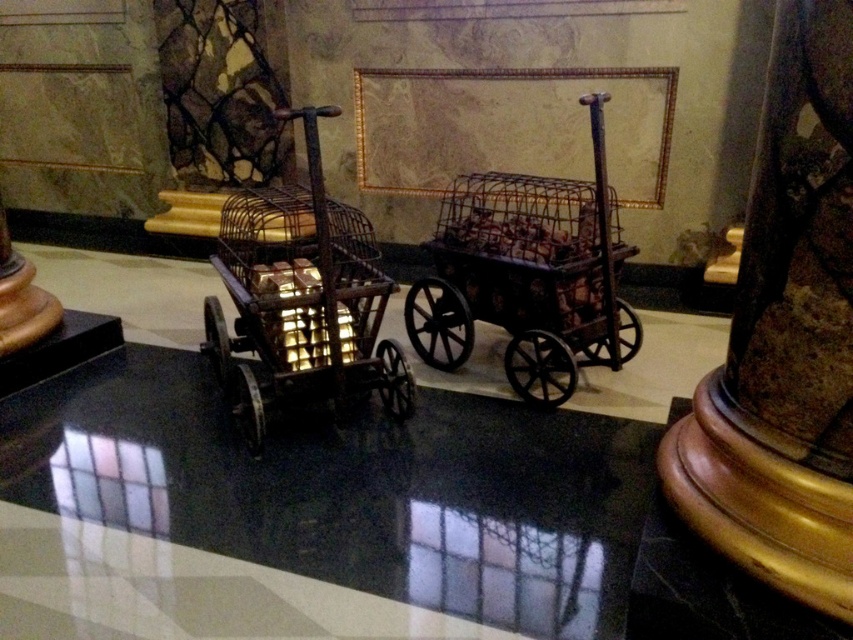
You are a museum curator planning to install a new exhibit label for the rusty metal trolley at center. The label must be placed exactly at the point specified by the coordinates provided. What object is located at point (302, 304)?

The point (302, 304) corresponds to the rusty metal trolley at center.

You are a museum curator planning to install a new exhibit. You have a new artifact that needs to be placed 20 cm to the left of the rusty metal trolley at center. Given the coordinates provided in the description, can you determine if there is enough space on the reflective black surface to place the new artifact without overlapping the existing carts?

The rusty metal trolley at center is located at point [302,304]. Since the coordinates are given without units, it is unclear if moving 20 cm to the left would overlap with other objects. Please provide coordinate units or measurements in centimeters for accurate assessment.